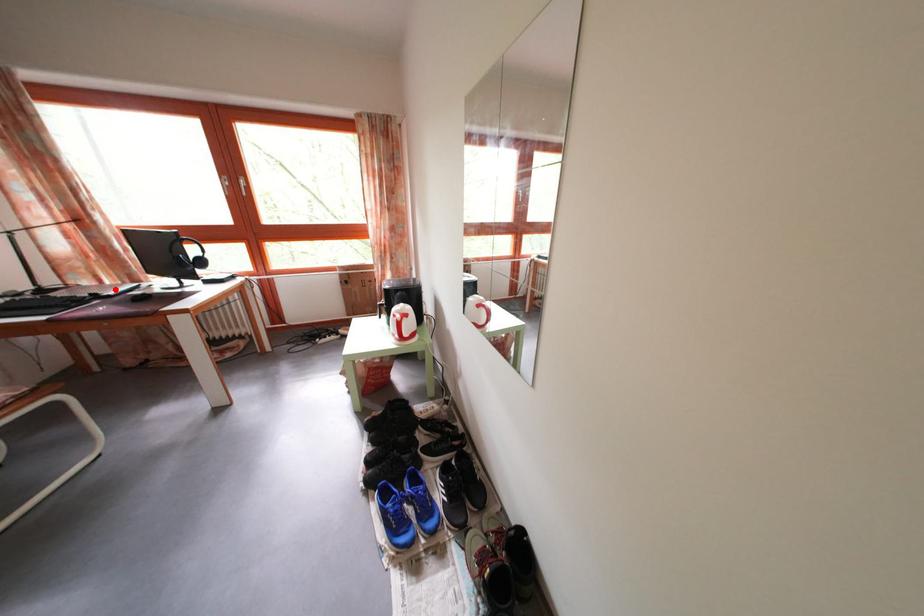
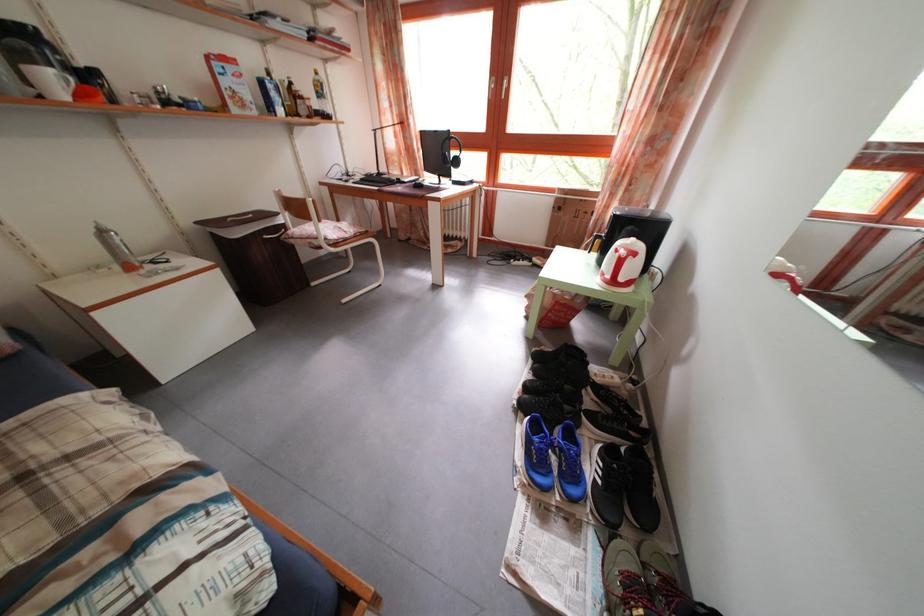
Where in the second image is the point corresponding to the highlighted location from the first image?

(412, 182)